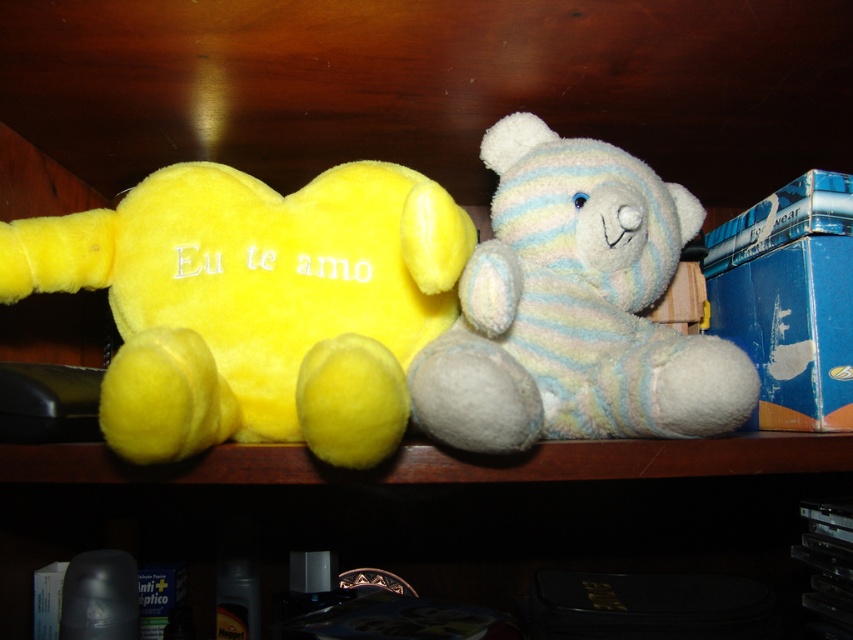
Based on the photo, you are standing in front of a wooden shelf with two plush toys. You see the yellow plush heart at center and the light blue and white striped teddy bear. Based on their positions, can you tell me which toy is exactly at the coordinates point [256,304]?

The yellow plush heart at center is located at point [256,304].

You are a child trying to grab the yellow plush heart at center and the white soft teddy bear at center from the shelf. Which one can you reach first without moving your hand?

The yellow plush heart at center is closer to the viewer than the white soft teddy bear at center, so you can reach it first without moving your hand.